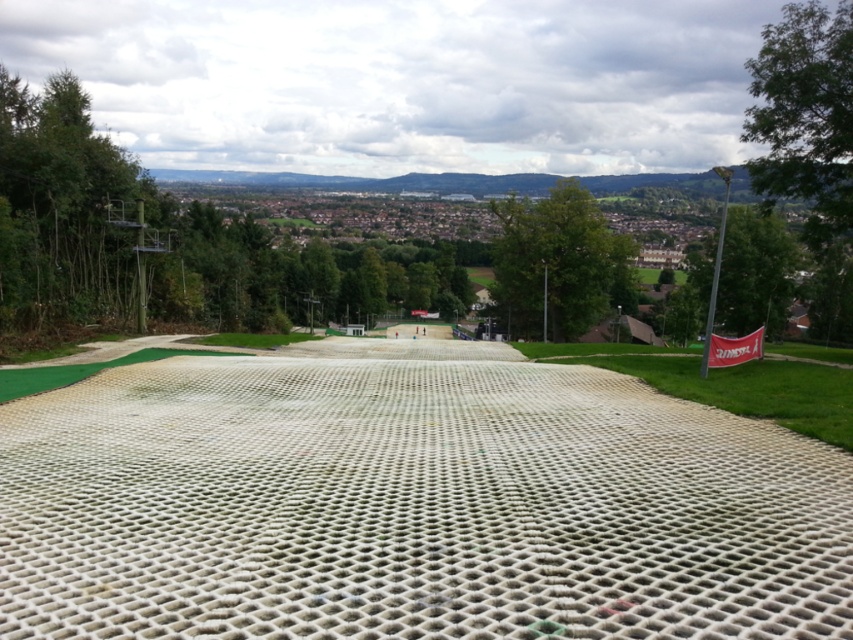
Question: Can you confirm if white mesh dirt track at center is thinner than white mesh golf course at center?

Choices:
 (A) yes
 (B) no

Answer: (B)

Question: Among these objects, which one is farthest from the camera?

Choices:
 (A) white mesh dirt track at center
 (B) white mesh golf course at center

Answer: (B)

Question: Which point appears closest to the camera in this image?

Choices:
 (A) (4, 502)
 (B) (822, 406)

Answer: (A)

Question: Does white mesh dirt track at center appear under white mesh golf course at center?

Choices:
 (A) no
 (B) yes

Answer: (B)

Question: Can you confirm if white mesh dirt track at center is bigger than white mesh golf course at center?

Choices:
 (A) yes
 (B) no

Answer: (A)